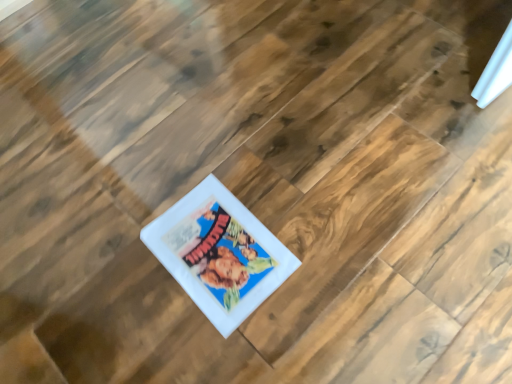
You are a GUI agent. You are given a task and a screenshot of the screen. Output one action in this format:
    pyautogui.click(x=<x>, y=<y>)
    Task: Click on the free space to the back side of white plastic picture frame at center
    The height and width of the screenshot is (384, 512).
    Given the screenshot: What is the action you would take?
    pyautogui.click(x=201, y=155)